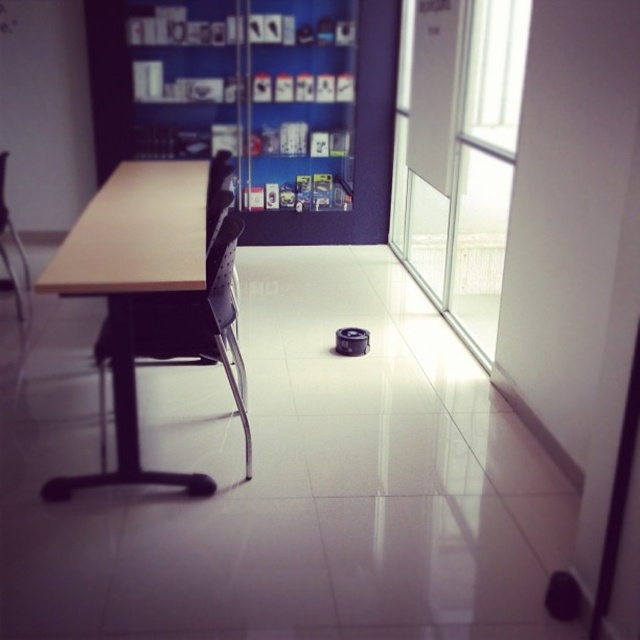
You are a delivery person who needs to place a box on the surface of the light brown wood table at center and the matte plastic chair at left. Which surface can you place the box on without it touching the floor?

The light brown wood table at center is taller than the matte plastic chair at left, so you can place the box on the light brown wood table at center without it touching the floor.

You are sitting in the office and want to move from your current position to the door located at the far end of the room. There is a light brown wood table at center and a matte plastic chair at left in your path. Which object should you avoid bumping into first?

You should avoid bumping into the matte plastic chair at left first because it is positioned to the left of the light brown wood table at center, meaning it is closer to your starting position.